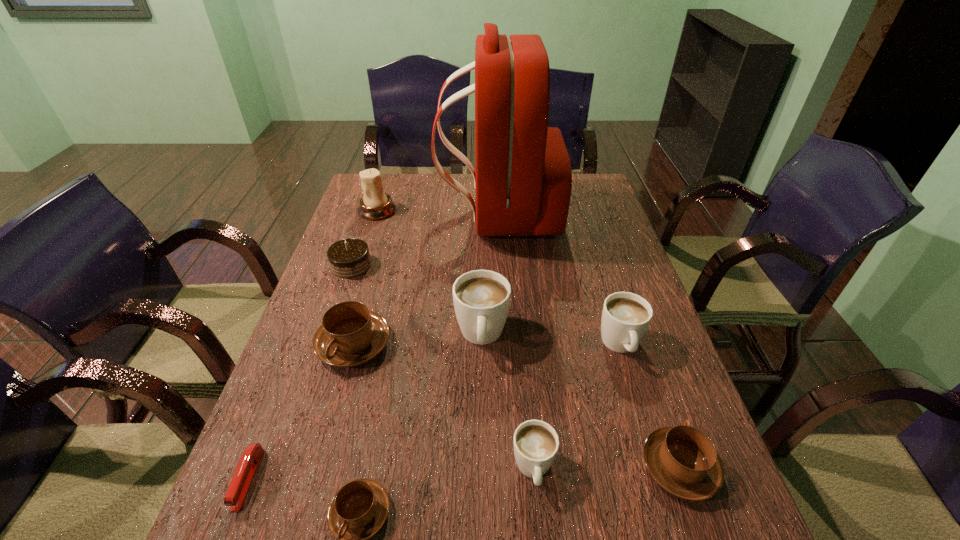
Locate an element on the screen. The width and height of the screenshot is (960, 540). vacant area located 0.080m on the side of the biggest brown cappuccino with the handle is located at coordinates (337, 404).

Where is `free space located on the side of the rightmost brown cappuccino with the handle`? The height and width of the screenshot is (540, 960). free space located on the side of the rightmost brown cappuccino with the handle is located at coordinates (623, 305).

You are a GUI agent. You are given a task and a screenshot of the screen. Output one action in this format:
    pyautogui.click(x=<x>, y=<y>)
    Task: Click on the vacant space located on the side of the rightmost brown cappuccino with the handle
    This screenshot has width=960, height=540.
    Given the screenshot: What is the action you would take?
    pyautogui.click(x=633, y=333)

In order to click on vacant space situated 0.350m on the side of the rightmost brown cappuccino with the handle in this screenshot , I will do 625,310.

The image size is (960, 540). Find the location of `backpack present at the far edge`. backpack present at the far edge is located at coordinates (523, 180).

The height and width of the screenshot is (540, 960). What are the coordinates of `candle holder at the far edge` in the screenshot? It's located at [375, 204].

The image size is (960, 540). I want to click on candle holder that is at the left edge, so click(375, 204).

At what (x,y) coordinates should I click in order to perform the action: click on chocolate cake at the left edge. Please return your answer as a coordinate pair (x, y). This screenshot has width=960, height=540. Looking at the image, I should click on (348, 258).

Image resolution: width=960 pixels, height=540 pixels. Identify the location of cappuccino located at the left edge. (350, 335).

Find the location of `stapler that is at the left edge`. stapler that is at the left edge is located at coordinates (239, 487).